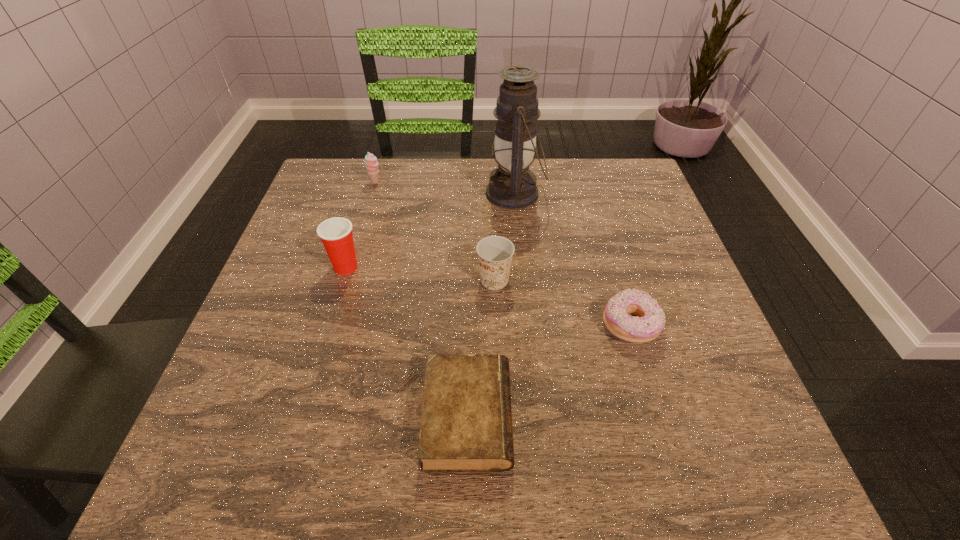
I want to click on vacant space located 0.130m on the right of the taller Dixie cup, so click(421, 267).

This screenshot has width=960, height=540. Identify the location of free space located on the right of the sherbert. (475, 183).

At what (x,y) coordinates should I click in order to perform the action: click on free space located 0.330m on the right of the right Dixie cup. Please return your answer as a coordinate pair (x, y). This screenshot has width=960, height=540. Looking at the image, I should click on (669, 280).

The height and width of the screenshot is (540, 960). In order to click on vacant space located on the right of the fifth farthest object in this screenshot , I will do `click(711, 326)`.

Where is `vacant space located 0.170m on the spine side of the nearest object`? The height and width of the screenshot is (540, 960). vacant space located 0.170m on the spine side of the nearest object is located at coordinates (615, 416).

The image size is (960, 540). I want to click on oil lamp positioned at the far edge, so click(x=512, y=185).

Image resolution: width=960 pixels, height=540 pixels. I want to click on sherbert that is at the far edge, so click(371, 162).

This screenshot has width=960, height=540. I want to click on object that is at the near edge, so click(x=466, y=422).

Find the location of a particular element. Dixie cup located at the left edge is located at coordinates (336, 234).

Locate an element on the screen. sherbert present at the left edge is located at coordinates (371, 162).